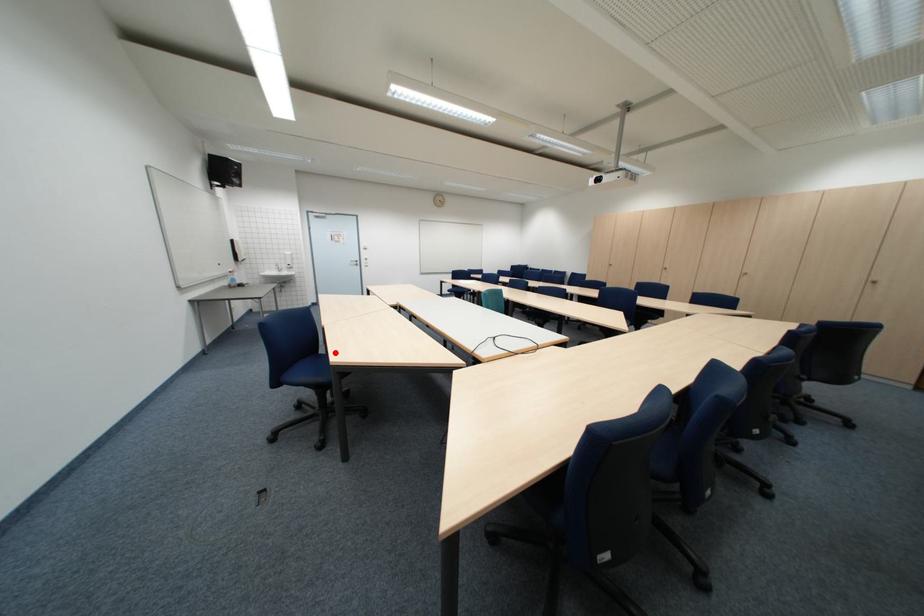
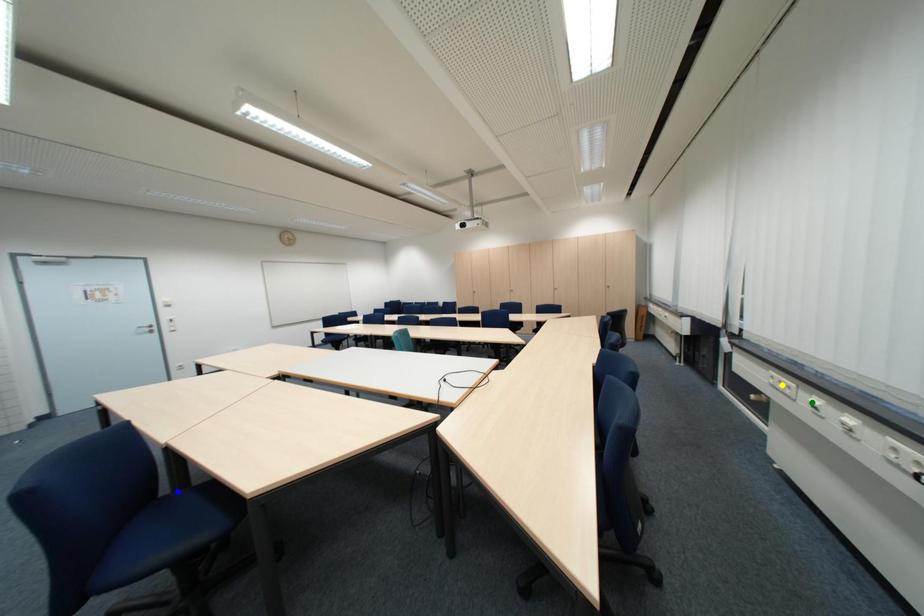
Question: I am providing you with two images of the same scene from different viewpoints. A red point is marked on the first image. You are given multiple points on the second image. In image 2, which mark is for the same physical point as the one in image 1?

Choices:
 (A) blue point
 (B) yellow point
 (C) green point

Answer: (A)